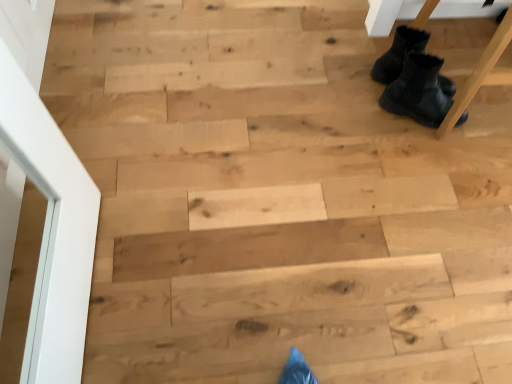
Question: From a real-world perspective, is black suede boots at upper right, placed as the second footwear when sorted from bottom to top, on black fuzzy boots at upper right, arranged as the 2th footwear when viewed from the top?

Choices:
 (A) yes
 (B) no

Answer: (A)

Question: Would you consider black suede boots at upper right, placed as the second footwear when sorted from bottom to top, to be distant from black fuzzy boots at upper right, arranged as the 2th footwear when viewed from the top?

Choices:
 (A) yes
 (B) no

Answer: (B)

Question: From the image's perspective, does black suede boots at upper right, placed as the second footwear when sorted from bottom to top, appear higher than black fuzzy boots at upper right, arranged as the 2th footwear when viewed from the top?

Choices:
 (A) yes
 (B) no

Answer: (A)

Question: Is black suede boots at upper right, placed as the second footwear when sorted from bottom to top, shorter than black fuzzy boots at upper right, positioned as the 1th footwear in bottom-to-top order?

Choices:
 (A) no
 (B) yes

Answer: (B)

Question: Is black suede boots at upper right, the 1th footwear from the top, not within black fuzzy boots at upper right, arranged as the 2th footwear when viewed from the top?

Choices:
 (A) yes
 (B) no

Answer: (A)

Question: Can black fuzzy boots at upper right, arranged as the 2th footwear when viewed from the top, be found inside black suede boots at upper right, placed as the second footwear when sorted from bottom to top?

Choices:
 (A) no
 (B) yes

Answer: (A)

Question: Is black suede boots at upper right, placed as the second footwear when sorted from bottom to top, at the back of black fuzzy boots at upper right, arranged as the 2th footwear when viewed from the top?

Choices:
 (A) yes
 (B) no

Answer: (B)

Question: Can you confirm if black fuzzy boots at upper right, arranged as the 2th footwear when viewed from the top, is bigger than black suede boots at upper right, placed as the second footwear when sorted from bottom to top?

Choices:
 (A) no
 (B) yes

Answer: (B)

Question: Is black fuzzy boots at upper right, positioned as the 1th footwear in bottom-to-top order, in contact with black suede boots at upper right, placed as the second footwear when sorted from bottom to top?

Choices:
 (A) yes
 (B) no

Answer: (A)

Question: Is black fuzzy boots at upper right, arranged as the 2th footwear when viewed from the top, facing towards black suede boots at upper right, placed as the second footwear when sorted from bottom to top?

Choices:
 (A) no
 (B) yes

Answer: (A)

Question: Is black fuzzy boots at upper right, positioned as the 1th footwear in bottom-to-top order, not close to black suede boots at upper right, placed as the second footwear when sorted from bottom to top?

Choices:
 (A) yes
 (B) no

Answer: (B)

Question: Is black suede boots at upper right, placed as the second footwear when sorted from bottom to top, completely or partially inside black fuzzy boots at upper right, positioned as the 1th footwear in bottom-to-top order?

Choices:
 (A) yes
 (B) no

Answer: (B)

Question: Does point (404, 43) appear closer or farther from the camera than point (417, 99)?

Choices:
 (A) farther
 (B) closer

Answer: (A)